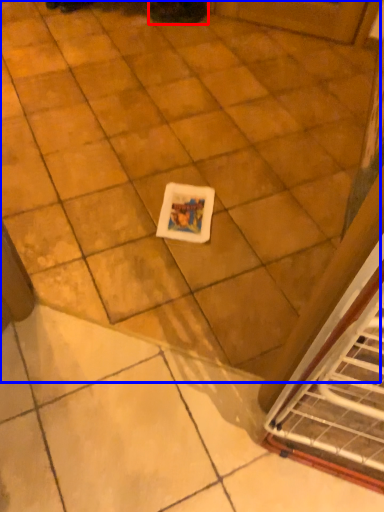
Question: Among these objects, which one is nearest to the camera, footwear (highlighted by a red box) or ceramic tile (highlighted by a blue box)?

Choices:
 (A) footwear
 (B) ceramic tile

Answer: (B)